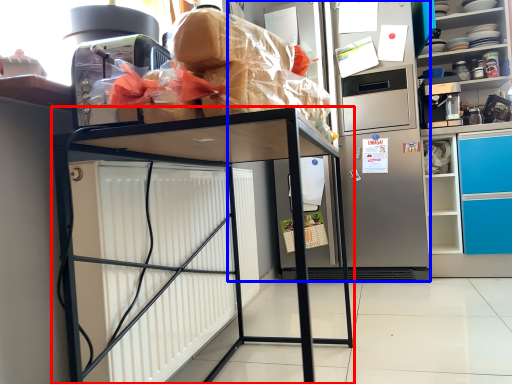
Question: Among these objects, which one is nearest to the camera, furniture (highlighted by a red box) or appliance (highlighted by a blue box)?

Choices:
 (A) furniture
 (B) appliance

Answer: (A)